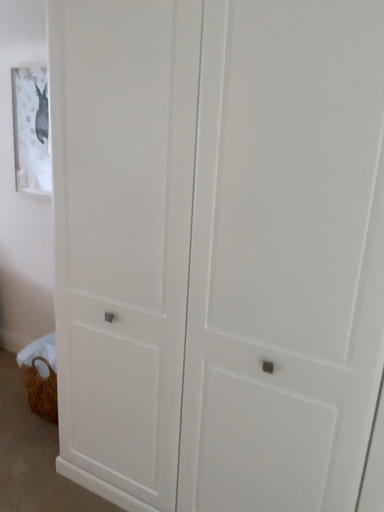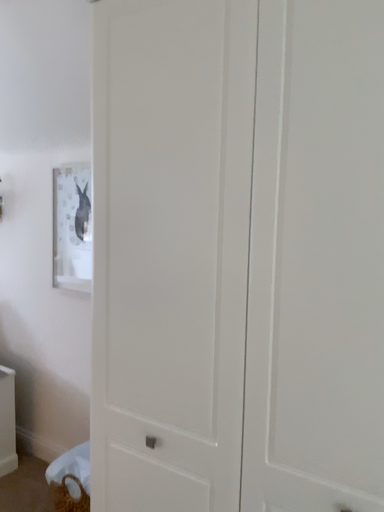
Question: How did the camera likely rotate when shooting the video?

Choices:
 (A) rotated upward
 (B) rotated downward

Answer: (A)